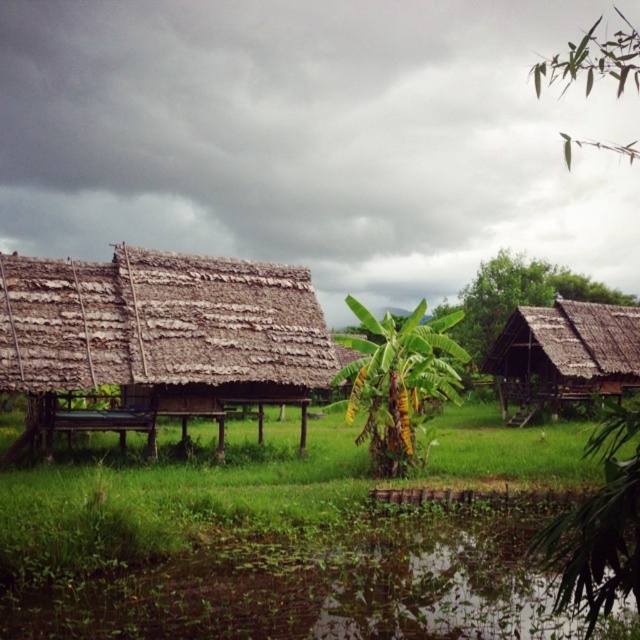
Which is more to the left, thatched straw hut at left or green grass at lower center?

thatched straw hut at left is more to the left.

Is thatched straw hut at left above green grass at lower center?

Indeed, thatched straw hut at left is positioned over green grass at lower center.

This screenshot has height=640, width=640. I want to click on thatched straw hut at left, so pyautogui.click(x=160, y=339).

Find the location of a particular element. thatched straw hut at left is located at coordinates pyautogui.click(x=160, y=339).

Between green leafy tree at upper right and green leafy tree at right, which one has less height?

Standing shorter between the two is green leafy tree at right.

Is green leafy tree at upper right positioned at the back of green leafy tree at right?

No, green leafy tree at upper right is in front of green leafy tree at right.

Which is in front, point (589, 525) or point (508, 314)?

Point (589, 525) is more forward.

I want to click on green leafy tree at upper right, so pyautogui.click(x=600, y=528).

What do you see at coordinates (160, 339) in the screenshot?
I see `thatched straw hut at left` at bounding box center [160, 339].

This screenshot has height=640, width=640. In order to click on thatched straw hut at left in this screenshot , I will do `click(160, 339)`.

The image size is (640, 640). Describe the element at coordinates (160, 339) in the screenshot. I see `thatched straw hut at left` at that location.

Find the location of a particular element. thatched straw hut at left is located at coordinates (160, 339).